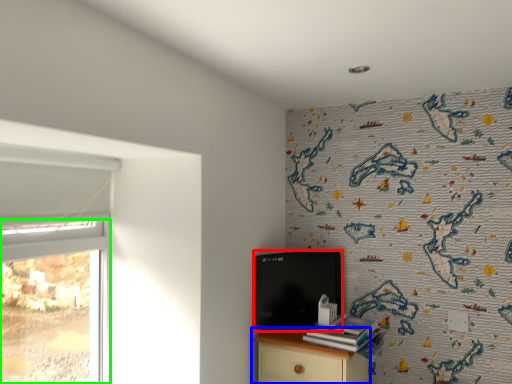
Question: Considering the real-world distances, which object is farthest from computer (highlighted by a red box)? nightstand (highlighted by a blue box) or window (highlighted by a green box)?

Choices:
 (A) nightstand
 (B) window

Answer: (B)